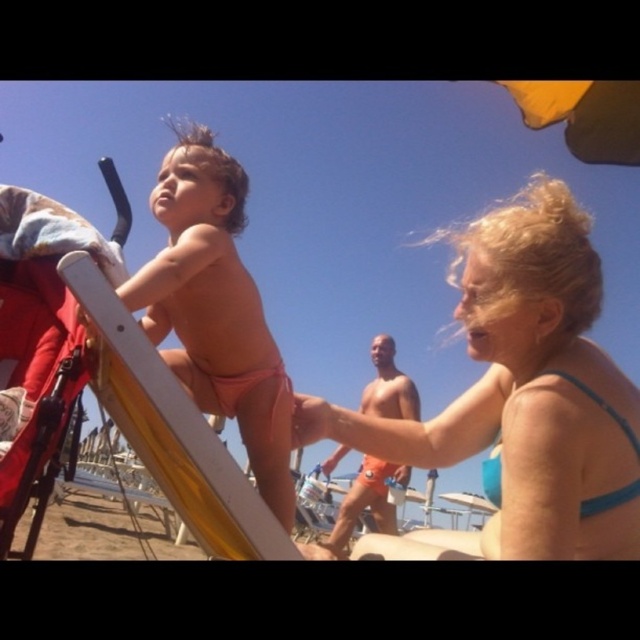
You are a photographer trying to capture the scene. You need to ensure that the blue fabric bikini top at upper right and the pink matte swimsuit at center are both visible in the frame. Based on their positions, which one is lower in the image?

The blue fabric bikini top at upper right is below the pink matte swimsuit at center, so it is lower in the image.

You are a photographer trying to capture the blue fabric bikini top at upper right in the image. According to the coordinates provided, where should you focus your camera to ensure it is centered in the frame?

To center the blue fabric bikini top at upper right, focus your camera at the coordinates point (518, 397).

You are a photographer taking a picture of the beach scene. The blue fabric bikini top at upper right is represented by point (518,397). Where is the blue fabric bikini top at upper right located in the image?

The blue fabric bikini top at upper right is located at point (518,397).